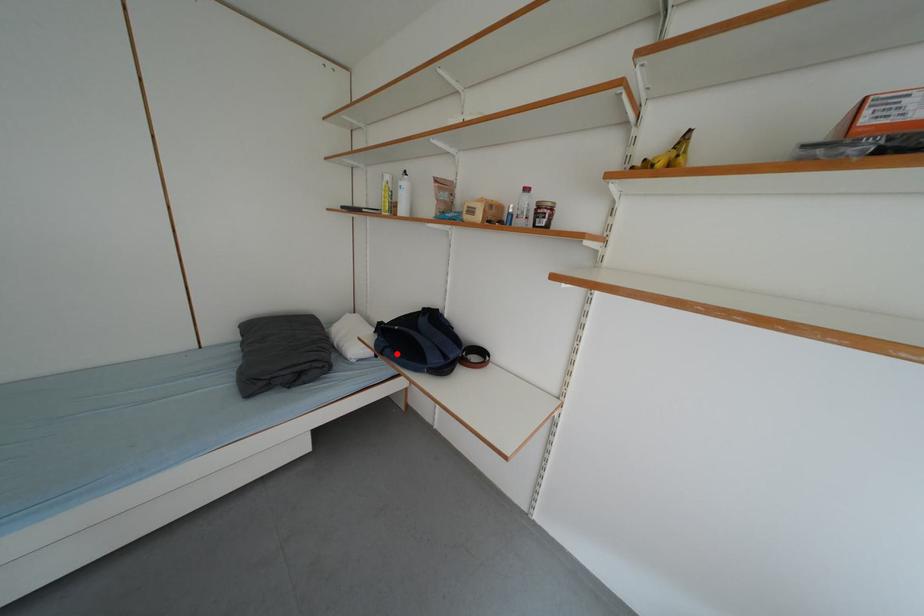
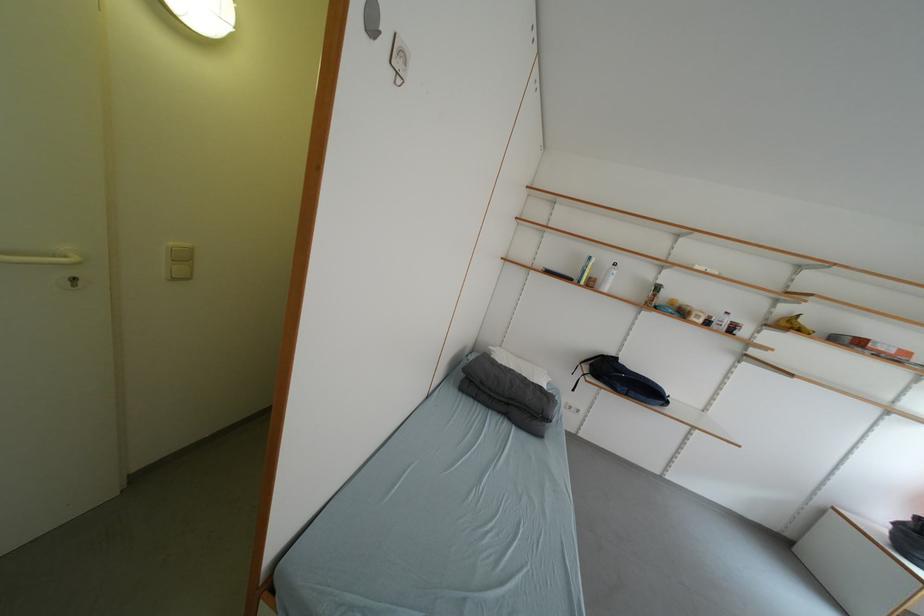
Question: I am providing you with two images of the same scene from different viewpoints. A red point is shown in image1. For the corresponding object point in image2, is it positioned nearer or farther from the camera?

Choices:
 (A) Nearer
 (B) Farther

Answer: (A)